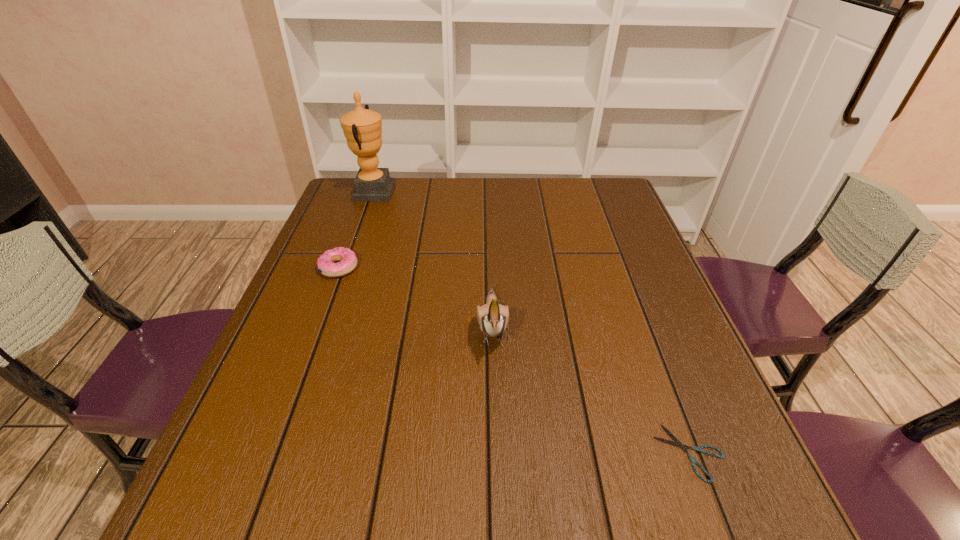
Image resolution: width=960 pixels, height=540 pixels. Identify the location of empty space that is in between the third farthest object and the award. (433, 260).

Find the location of a particular element. blank region between the second shortest object and the shortest object is located at coordinates (515, 360).

The width and height of the screenshot is (960, 540). In order to click on empty space that is in between the second object from right to left and the tallest object in this screenshot , I will do `click(433, 260)`.

Find the location of a particular element. The width and height of the screenshot is (960, 540). empty space between the bird and the rightmost object is located at coordinates (591, 389).

Locate an element on the screen. This screenshot has width=960, height=540. vacant region between the third tallest object and the tallest object is located at coordinates (356, 230).

Identify which object is the third closest to the third nearest object. Please provide its 2D coordinates. Your answer should be formatted as a tuple, i.e. [(x, y)], where the tuple contains the x and y coordinates of a point satisfying the conditions above.

[(677, 443)]

You are a GUI agent. You are given a task and a screenshot of the screen. Output one action in this format:
    pyautogui.click(x=<x>, y=<y>)
    Task: Click on the object identified as the third closest to the rightmost object
    The height and width of the screenshot is (540, 960).
    Given the screenshot: What is the action you would take?
    pyautogui.click(x=362, y=128)

The image size is (960, 540). Find the location of `free spot that satisfies the following two spatial constraints: 1. on the front side of the second farthest object; 2. on the left side of the rightmost object`. free spot that satisfies the following two spatial constraints: 1. on the front side of the second farthest object; 2. on the left side of the rightmost object is located at coordinates (270, 453).

At what (x,y) coordinates should I click in order to perform the action: click on vacant region that satisfies the following two spatial constraints: 1. on the front side of the shears; 2. on the left side of the third nearest object. Please return your answer as a coordinate pair (x, y). The width and height of the screenshot is (960, 540). Looking at the image, I should click on (270, 453).

The image size is (960, 540). What are the coordinates of `vacant space that satisfies the following two spatial constraints: 1. at the face of the third farthest object; 2. on the left side of the rightmost object` in the screenshot? It's located at (495, 453).